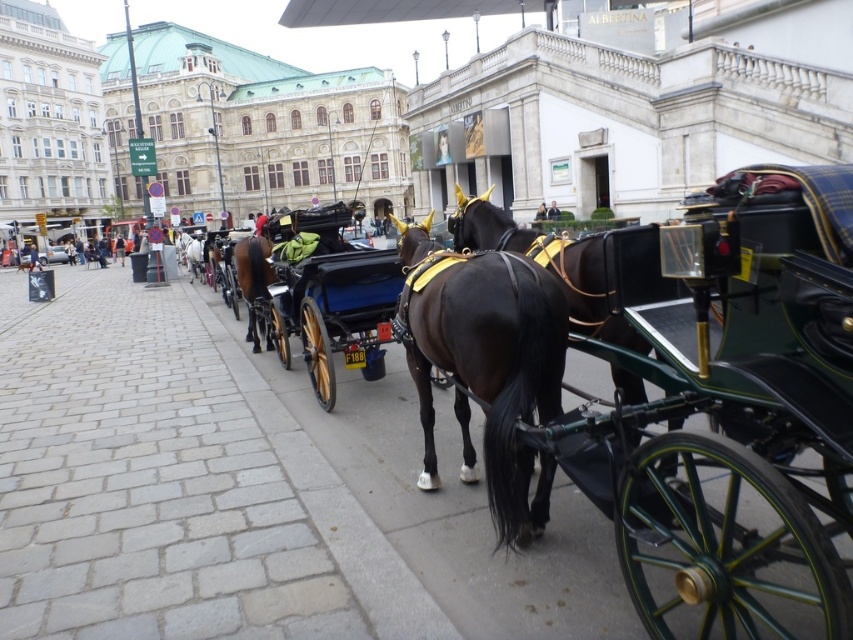
Question: Does black glossy horse at center have a smaller size compared to shiny black horse at center?

Choices:
 (A) yes
 (B) no

Answer: (B)

Question: Based on their relative distances, which object is nearer to the gray cobblestone pavement at lower left?

Choices:
 (A) black glossy horse at center
 (B) shiny black cart at center
 (C) shiny brown horse at center

Answer: (C)

Question: Estimate the real-world distances between objects in this image. Which object is closer to the gray cobblestone pavement at lower left?

Choices:
 (A) shiny black horse at center
 (B) shiny black cart at center

Answer: (B)

Question: Estimate the real-world distances between objects in this image. Which object is closer to the shiny brown horse at center?

Choices:
 (A) gray cobblestone pavement at lower left
 (B) shiny black horse at center

Answer: (A)

Question: In this image, where is shiny black cart at center located relative to black glossy horse at center?

Choices:
 (A) right
 (B) left

Answer: (A)

Question: Is black glossy horse at center bigger than shiny brown horse at center?

Choices:
 (A) yes
 (B) no

Answer: (A)